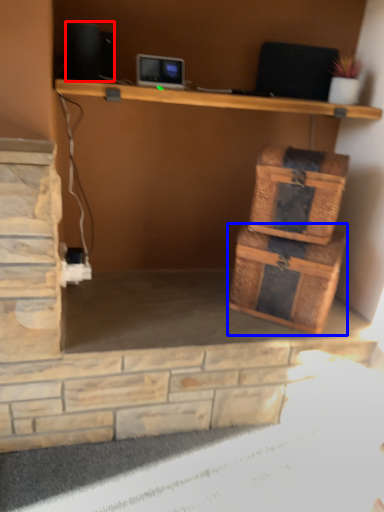
Question: Which object is further to the camera taking this photo, speaker (highlighted by a red box) or storage box (highlighted by a blue box)?

Choices:
 (A) speaker
 (B) storage box

Answer: (B)